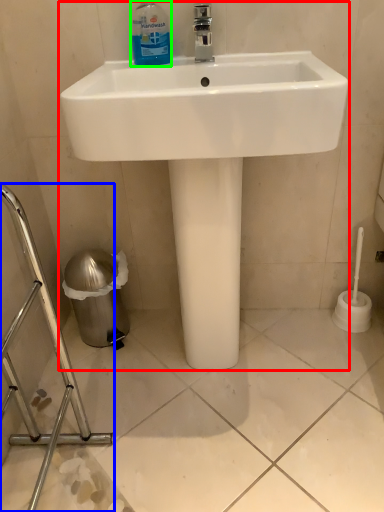
Question: Based on their relative distances, which object is farther from sink (highlighted by a red box)? Choose from porcelain (highlighted by a blue box) and cleaning product (highlighted by a green box).

Choices:
 (A) porcelain
 (B) cleaning product

Answer: (A)